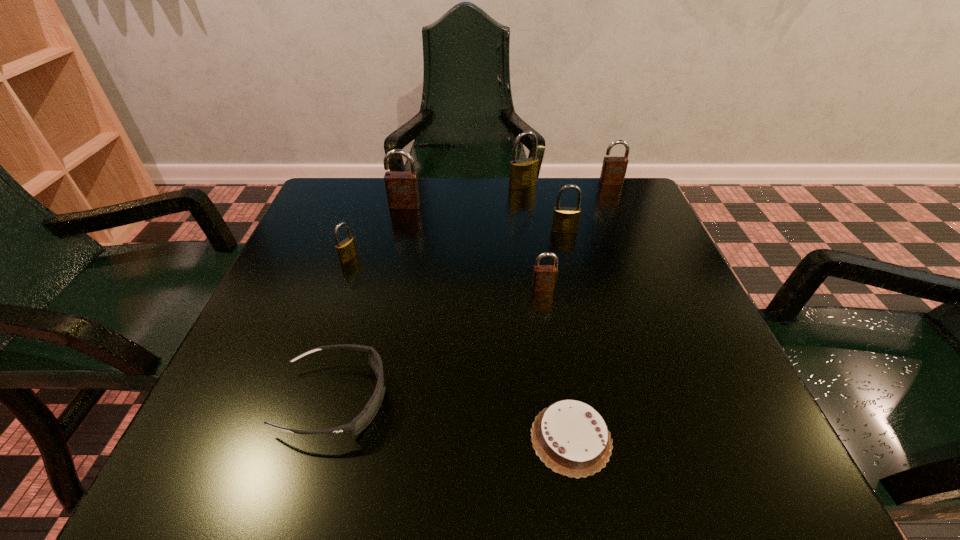
Identify the location of the third nearest object. (544, 276).

Where is `the nearest brown padlock`? The image size is (960, 540). the nearest brown padlock is located at coordinates (544, 276).

Identify the location of black goggles. (359, 423).

Where is `goggles`? goggles is located at coordinates (359, 423).

Locate an element on the screen. the shortest object is located at coordinates (570, 437).

The image size is (960, 540). I want to click on blank space located 0.060m on the right of the second brass padlock from left to right, so click(560, 186).

Find the location of `free space located 0.380m on the front-facing side of the biggest brown padlock`. free space located 0.380m on the front-facing side of the biggest brown padlock is located at coordinates (377, 326).

Where is `free point located 0.390m on the front-facing side of the rightmost brown padlock`? The width and height of the screenshot is (960, 540). free point located 0.390m on the front-facing side of the rightmost brown padlock is located at coordinates (656, 286).

I want to click on free spot located on the front of the second padlock from right to left, so click(x=596, y=361).

In order to click on vacant area situated 0.070m on the front of the leftmost padlock in this screenshot , I will do `click(338, 287)`.